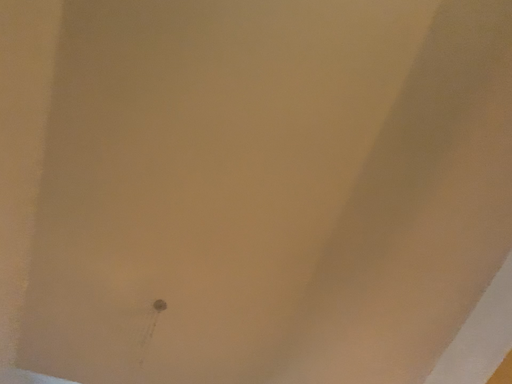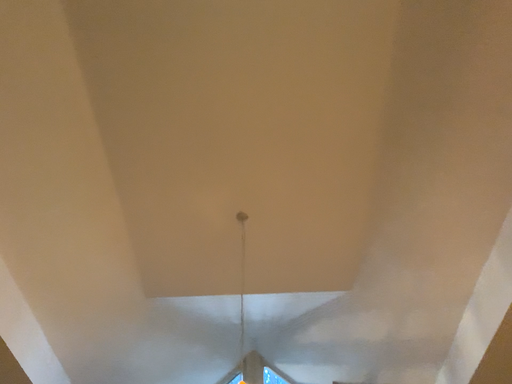
Question: Which way did the camera rotate in the video?

Choices:
 (A) rotated left
 (B) rotated right

Answer: (A)